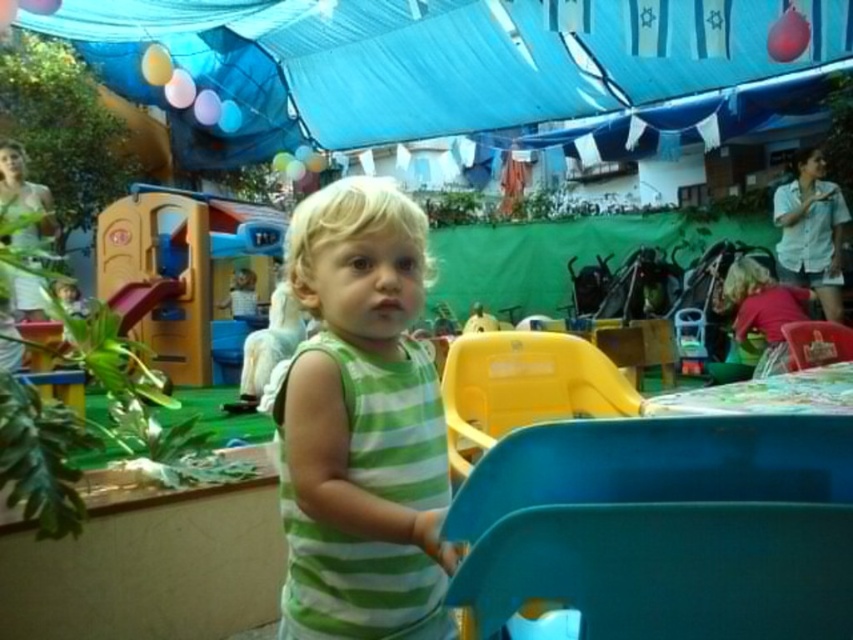
Is blue fabric canopy at upper center above green striped tank top at center?

Indeed, blue fabric canopy at upper center is positioned over green striped tank top at center.

Find the location of a particular element. The width and height of the screenshot is (853, 640). blue fabric canopy at upper center is located at coordinates (440, 58).

Does point (821, 1) lie in front of point (354, 307)?

No, it is behind (354, 307).

Where is `blue fabric canopy at upper center`? Image resolution: width=853 pixels, height=640 pixels. blue fabric canopy at upper center is located at coordinates (440, 58).